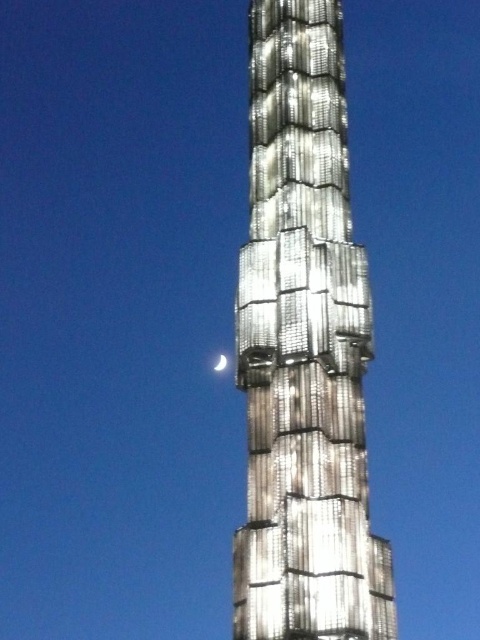
Question: Which point appears closest to the camera in this image?

Choices:
 (A) (218, 371)
 (B) (320, 349)

Answer: (B)

Question: In this image, where is metallic silver tower at center located relative to silvery metallic moon at center?

Choices:
 (A) left
 (B) right

Answer: (B)

Question: Is metallic silver tower at center below silvery metallic moon at center?

Choices:
 (A) no
 (B) yes

Answer: (A)

Question: Which point is farther from the camera taking this photo?

Choices:
 (A) tap(300, 134)
 (B) tap(223, 369)

Answer: (B)

Question: Does metallic silver tower at center have a lesser width compared to silvery metallic moon at center?

Choices:
 (A) no
 (B) yes

Answer: (A)